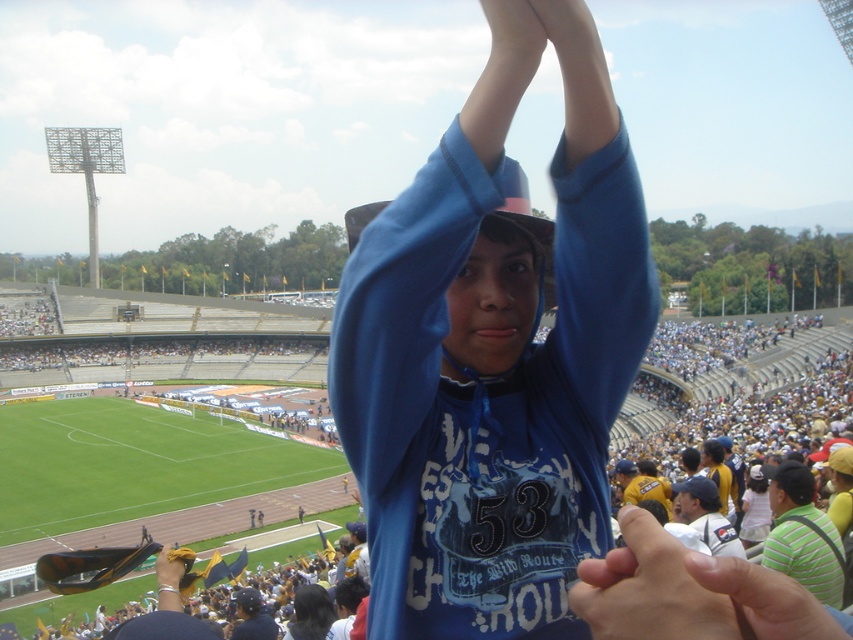
You are a photographer at the stadium and want to capture a photo of the white jersey at center without the smooth skin hand at center blocking it. Based on their positions, which direction should you move your camera to the right or left to avoid the hand?

The smooth skin hand at center is to the left of the white jersey at center. To avoid the hand blocking the jersey, move the camera to the right.

You are a photographer standing at the edge of the stadium field. You want to take a photo of the smooth skin hand at center and the dark blue hoodie at center so that both are clearly visible in the frame. Given their distance apart, is it possible to capture both in a single shot without moving your position?

The smooth skin hand at center and dark blue hoodie at center are 43.14 meters apart from each other. Depending on the camera lens used, capturing both in a single shot may be possible if the lens has a wide enough angle to cover the 43.14 meter distance between them while maintaining both in focus and within the frame.

You are a photographer at the stadium and want to capture a closeup of the hand at point (689, 593). Based on the scene description, which object in the image is located at that coordinate?

The smooth skin hand at center is located at point (689, 593).